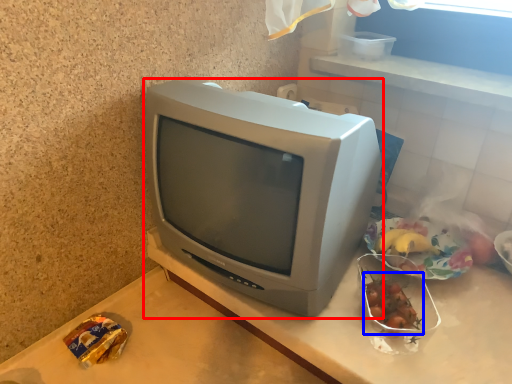
Question: Which object appears closest to the camera in this image, television (highlighted by a red box) or food (highlighted by a blue box)?

Choices:
 (A) television
 (B) food

Answer: (A)